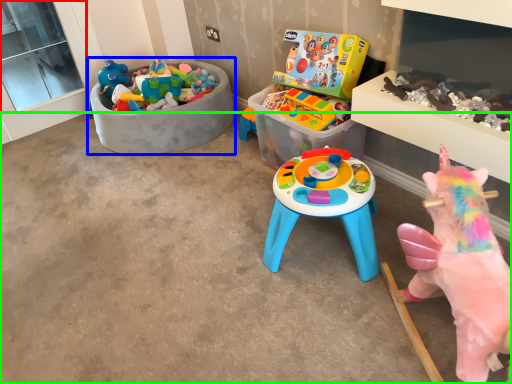
Question: Which object is the farthest from window screen (highlighted by a red box)? Choose among these: toy (highlighted by a blue box) or concrete (highlighted by a green box).

Choices:
 (A) toy
 (B) concrete

Answer: (B)